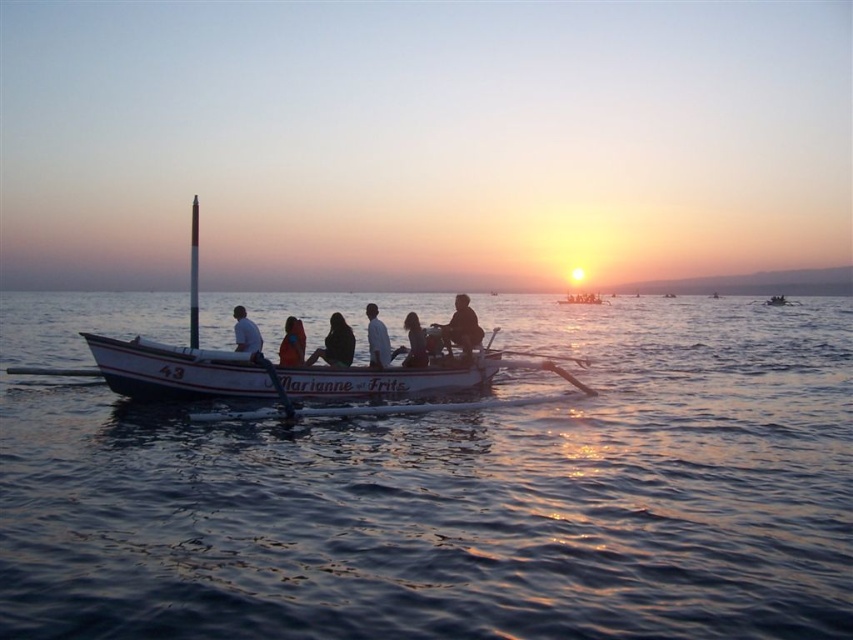
Question: Is blue water at center positioned at the back of white wooden canoe at center?

Choices:
 (A) yes
 (B) no

Answer: (B)

Question: Among these points, which one is nearest to the camera?

Choices:
 (A) (367, 333)
 (B) (469, 332)

Answer: (A)

Question: Does white wooden boat at center appear on the right side of white matte shirt at center?

Choices:
 (A) yes
 (B) no

Answer: (B)

Question: Which of these objects is positioned closest to the orange life vest at center?

Choices:
 (A) white wooden canoe at center
 (B) matte black shirt at center
 (C) wooden paddle at center

Answer: (C)

Question: Which of the following is the farthest from the observer?

Choices:
 (A) wooden paddle at center
 (B) matte black shirt at center
 (C) white wooden boat at center
 (D) blue water at center

Answer: (B)

Question: Can you confirm if white wooden boat at center is positioned below white matte shirt at center?

Choices:
 (A) no
 (B) yes

Answer: (A)